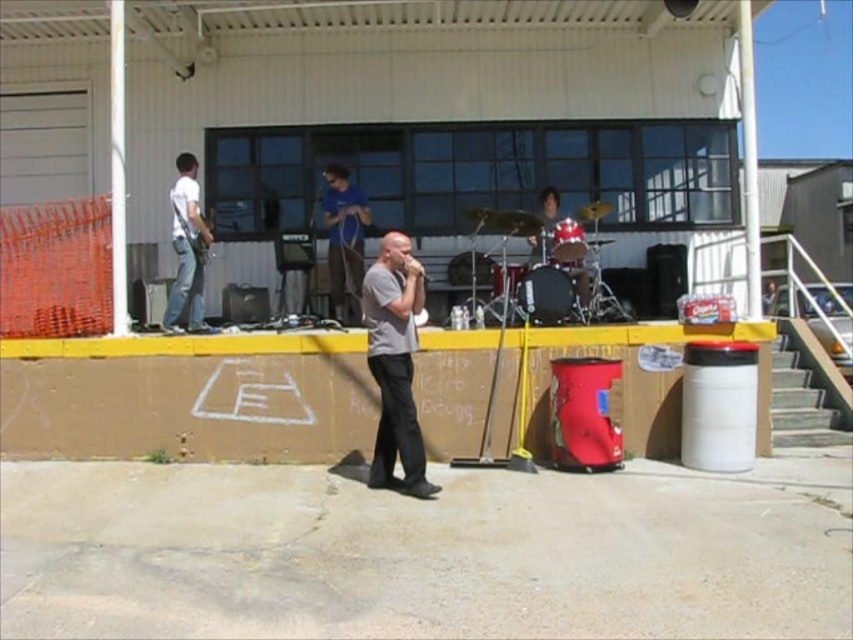
Question: Considering the real-world distances, which object is closest to the gray matte shirt at center?

Choices:
 (A) blue cotton shirt at center
 (B) white matte guitar at left

Answer: (B)

Question: Is gray matte shirt at center positioned before blue cotton shirt at center?

Choices:
 (A) yes
 (B) no

Answer: (A)

Question: In this image, where is gray matte shirt at center located relative to blue cotton shirt at center?

Choices:
 (A) left
 (B) right

Answer: (B)

Question: Which of the following is the closest to the observer?

Choices:
 (A) white matte guitar at left
 (B) gray matte shirt at center

Answer: (B)

Question: Among these points, which one is farthest from the camera?

Choices:
 (A) [x=352, y=198]
 (B) [x=189, y=284]

Answer: (A)

Question: Can you confirm if gray matte shirt at center is positioned to the left of blue cotton shirt at center?

Choices:
 (A) no
 (B) yes

Answer: (A)